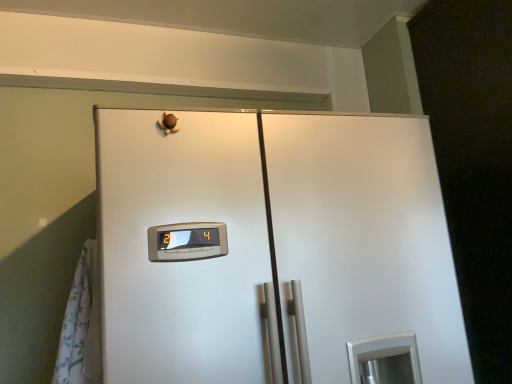
You are a GUI agent. You are given a task and a screenshot of the screen. Output one action in this format:
    pyautogui.click(x=<x>, y=<y>)
    Task: Click on the white floral fabric curtain at left
    This screenshot has width=512, height=384.
    Given the screenshot: What is the action you would take?
    pyautogui.click(x=75, y=323)

The height and width of the screenshot is (384, 512). Describe the element at coordinates (75, 323) in the screenshot. I see `white floral fabric curtain at left` at that location.

The height and width of the screenshot is (384, 512). What are the coordinates of `satin white refrigerator at center` in the screenshot? It's located at (274, 246).

The height and width of the screenshot is (384, 512). What do you see at coordinates (274, 246) in the screenshot? I see `satin white refrigerator at center` at bounding box center [274, 246].

Image resolution: width=512 pixels, height=384 pixels. In order to click on white floral fabric curtain at left in this screenshot , I will do point(75,323).

In the image, is satin white refrigerator at center on the left side or the right side of white floral fabric curtain at left?

Clearly, satin white refrigerator at center is on the right of white floral fabric curtain at left in the image.

Is satin white refrigerator at center in front of white floral fabric curtain at left?

That is True.

Considering the points (396, 171) and (86, 256), which point is in front, point (396, 171) or point (86, 256)?

Point (86, 256)

Consider the image. From the image's perspective, is satin white refrigerator at center below white floral fabric curtain at left?

Yes.

From a real-world perspective, is satin white refrigerator at center over white floral fabric curtain at left?

Yes.

Between satin white refrigerator at center and white floral fabric curtain at left, which one has smaller width?

white floral fabric curtain at left is thinner.

Which of these two, satin white refrigerator at center or white floral fabric curtain at left, stands shorter?

white floral fabric curtain at left is shorter.

Does satin white refrigerator at center have a larger size compared to white floral fabric curtain at left?

Correct, satin white refrigerator at center is larger in size than white floral fabric curtain at left.

Do you think satin white refrigerator at center is within white floral fabric curtain at left, or outside of it?

satin white refrigerator at center is outside white floral fabric curtain at left.

Is satin white refrigerator at center next to white floral fabric curtain at left?

There is a gap between satin white refrigerator at center and white floral fabric curtain at left.

Is satin white refrigerator at center turned away from white floral fabric curtain at left?

No.

Consider the image. How many degrees apart are the facing directions of satin white refrigerator at center and white floral fabric curtain at left?

90 degrees.

Measure the distance between satin white refrigerator at center and white floral fabric curtain at left.

satin white refrigerator at center is 19.91 inches from white floral fabric curtain at left.

Find the location of a particular element. The image size is (512, 384). curtain located behind the satin white refrigerator at center is located at coordinates (75, 323).

Is white floral fabric curtain at left at the left side of satin white refrigerator at center?

Yes, white floral fabric curtain at left is to the left of satin white refrigerator at center.

Looking at this image, is white floral fabric curtain at left further to camera compared to satin white refrigerator at center?

Yes, it is.

Does point (81, 307) come behind point (407, 173)?

No, (81, 307) is in front of (407, 173).

From the image's perspective, relative to satin white refrigerator at center, is white floral fabric curtain at left above or below?

Based on their image positions, white floral fabric curtain at left is located above satin white refrigerator at center.

From a real-world perspective, is white floral fabric curtain at left under satin white refrigerator at center?

Yes, from a real-world perspective, white floral fabric curtain at left is beneath satin white refrigerator at center.

Considering the sizes of objects white floral fabric curtain at left and satin white refrigerator at center in the image provided, who is wider, white floral fabric curtain at left or satin white refrigerator at center?

With larger width is satin white refrigerator at center.

Based on the photo, which of these two, white floral fabric curtain at left or satin white refrigerator at center, stands shorter?

white floral fabric curtain at left.

From the picture: Can you confirm if white floral fabric curtain at left is smaller than satin white refrigerator at center?

Correct, white floral fabric curtain at left occupies less space than satin white refrigerator at center.

Which is correct: white floral fabric curtain at left is inside satin white refrigerator at center, or outside of it?

The correct answer is: outside.

Is there a large distance between white floral fabric curtain at left and satin white refrigerator at center?

That's not correct — white floral fabric curtain at left is a little close to satin white refrigerator at center.

Could you tell me if white floral fabric curtain at left is turned towards satin white refrigerator at center?

No.

How many degrees apart are the facing directions of white floral fabric curtain at left and satin white refrigerator at center?

There is a 90-degree angle between the facing directions of white floral fabric curtain at left and satin white refrigerator at center.

You are a GUI agent. You are given a task and a screenshot of the screen. Output one action in this format:
    pyautogui.click(x=<x>, y=<y>)
    Task: Click on the refrigerator lying in front of the white floral fabric curtain at left
    
    Given the screenshot: What is the action you would take?
    pyautogui.click(x=274, y=246)

Image resolution: width=512 pixels, height=384 pixels. Identify the location of curtain behind the satin white refrigerator at center. (75, 323).

There is a white floral fabric curtain at left. Identify the location of refrigerator above it (from a real-world perspective). (274, 246).